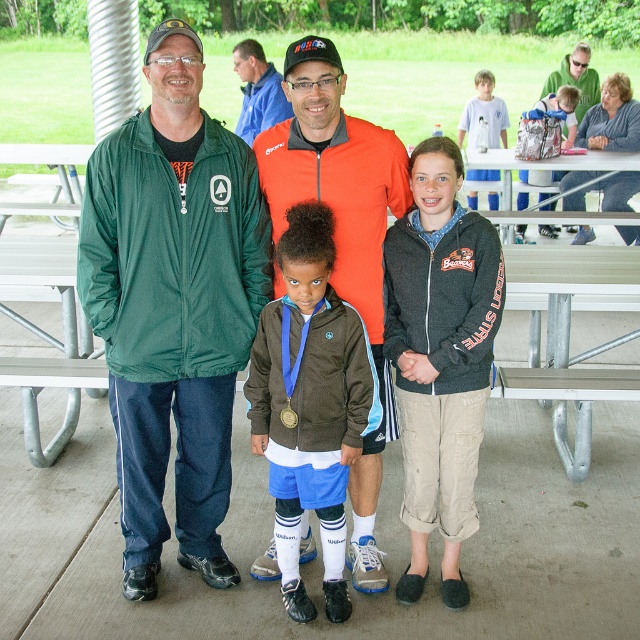
You are a photographer trying to capture a photo of the group. You notice the green fleece jacket at left and the silver metallic backpack at upper right. Which object should you focus on first if you want to include both in your frame without moving the camera?

The green fleece jacket at left is positioned on the left side of the silver metallic backpack at upper right. To include both in the frame without moving the camera, you should focus on the green fleece jacket at left first since it is closer to the left edge, ensuring both objects remain in the shot.

You are a photographer trying to capture a clear shot of both the man on the left and the man on the right in the group photo. You notice two specific points marked as point 1 at coordinates point (419, 170) and point 2 at coordinates point (291, 420). Which point should you focus on to ensure both men are in focus?

You should focus on point 1 at coordinates point (419, 170) because it is closer to the viewer than point 2 at coordinates point (291, 420). Since both men are part of the group standing under the shelter, focusing on the closer point will help ensure both are in focus.